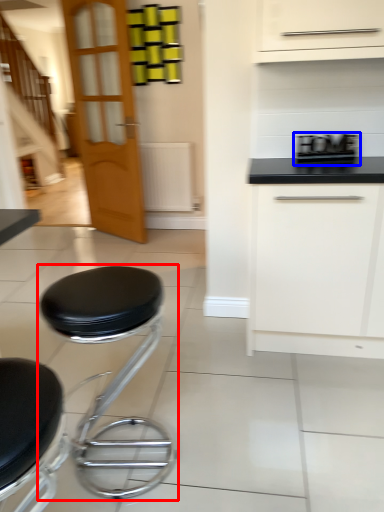
Question: Among these objects, which one is farthest to the camera, stool (highlighted by a red box) or appliance (highlighted by a blue box)?

Choices:
 (A) stool
 (B) appliance

Answer: (B)